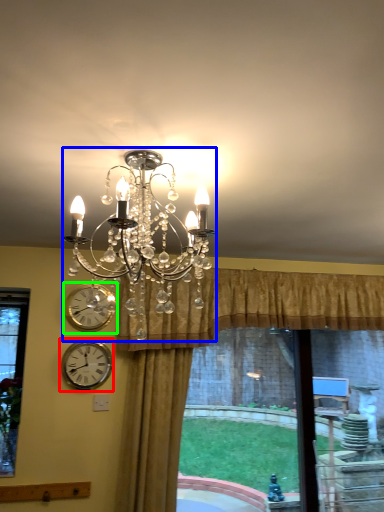
Question: Which object is the closest to the wall clock (highlighted by a red box)? Choose among these: lamp (highlighted by a blue box) or wall clock (highlighted by a green box).

Choices:
 (A) lamp
 (B) wall clock

Answer: (B)